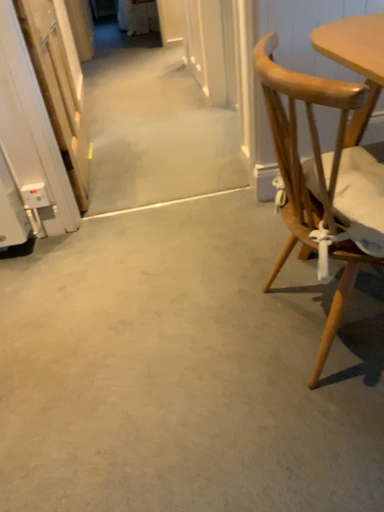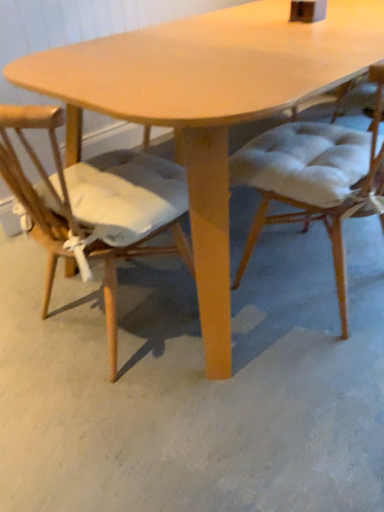
Question: How did the camera likely rotate when shooting the video?

Choices:
 (A) rotated downward
 (B) rotated upward

Answer: (B)